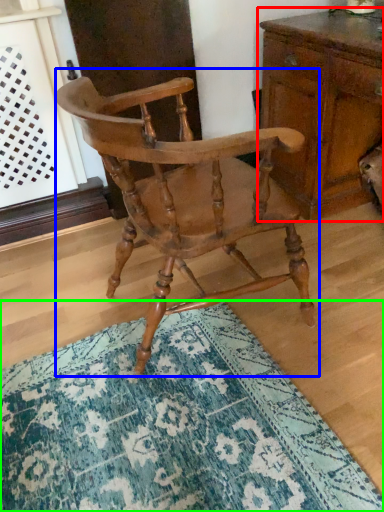
Question: Which object is positioned farthest from chest of drawers (highlighted by a red box)? Select from chair (highlighted by a blue box) and doormat (highlighted by a green box).

Choices:
 (A) chair
 (B) doormat

Answer: (B)